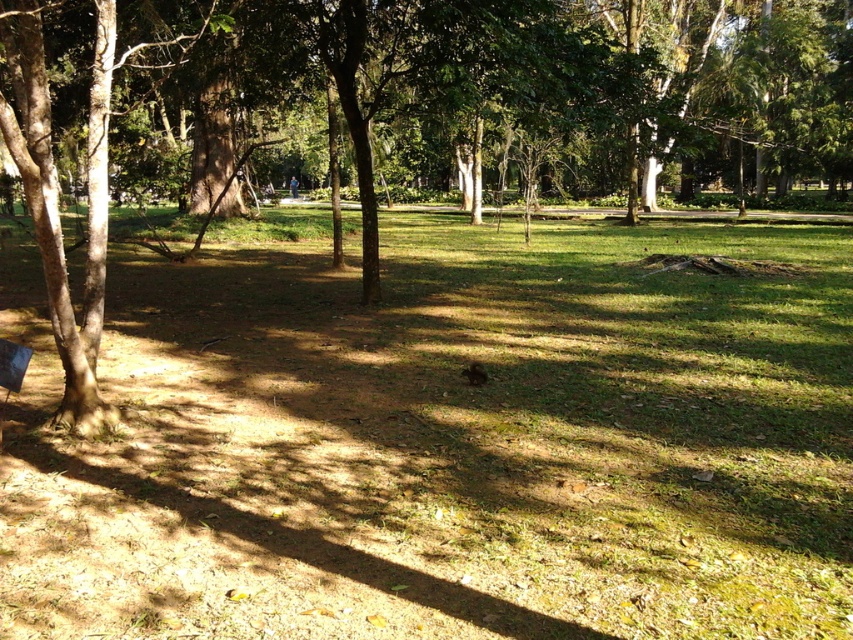
Question: Which object is positioned closest to the wooden park bench at lower left?

Choices:
 (A) green grassy at center
 (B) brown textured tree at center

Answer: (A)

Question: Can you confirm if brown textured tree at center is thinner than wooden park bench at lower left?

Choices:
 (A) no
 (B) yes

Answer: (A)

Question: Can you confirm if green grassy at center is positioned below wooden park bench at lower left?

Choices:
 (A) no
 (B) yes

Answer: (A)

Question: Which point is closer to the camera?

Choices:
 (A) wooden park bench at lower left
 (B) green grassy at center
 (C) brown textured tree at center

Answer: (B)

Question: Which is nearer to the wooden park bench at lower left?

Choices:
 (A) green grassy at center
 (B) brown textured tree at center

Answer: (A)

Question: Can you confirm if green grassy at center is positioned to the right of brown textured tree at center?

Choices:
 (A) yes
 (B) no

Answer: (A)